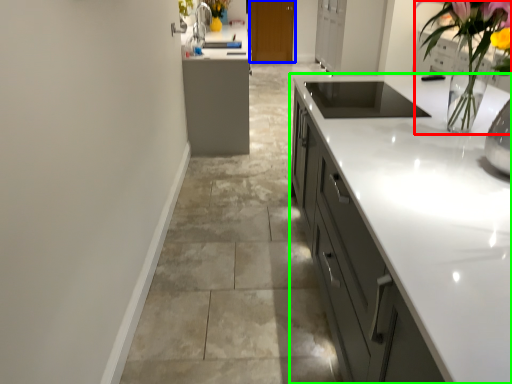
Question: Based on their relative distances, which object is nearer to floral arrangement (highlighted by a red box)? Choose from cabinetry (highlighted by a blue box) and cabinetry (highlighted by a green box).

Choices:
 (A) cabinetry
 (B) cabinetry

Answer: (B)